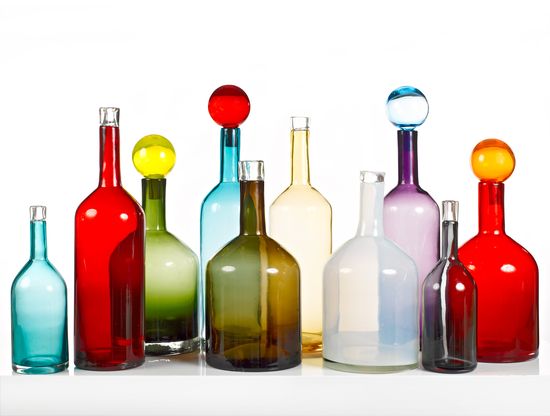
Find the location of a particular element. colored bottles is located at coordinates (30, 305), (92, 226), (168, 273), (211, 208), (235, 286), (284, 213), (375, 292), (409, 208), (446, 305), (509, 270).